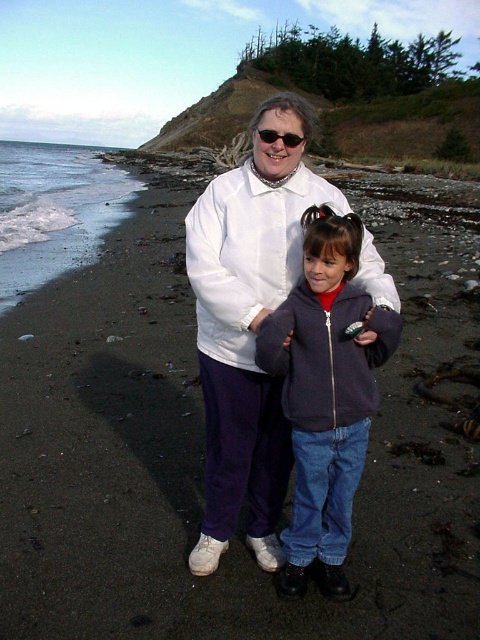
Question: Which point is farther to the camera?

Choices:
 (A) (309, 321)
 (B) (288, 138)

Answer: (B)

Question: Can you confirm if dark gray fleece jacket at center is bigger than matte black sunglasses at center?

Choices:
 (A) no
 (B) yes

Answer: (B)

Question: Does dark gray fleece jacket at center appear over matte black sunglasses at center?

Choices:
 (A) no
 (B) yes

Answer: (A)

Question: Can you confirm if dark gray fleece jacket at center is positioned to the right of matte black sunglasses at center?

Choices:
 (A) no
 (B) yes

Answer: (B)

Question: Among these objects, which one is nearest to the camera?

Choices:
 (A) dark gray fleece jacket at center
 (B) matte black sunglasses at center

Answer: (A)